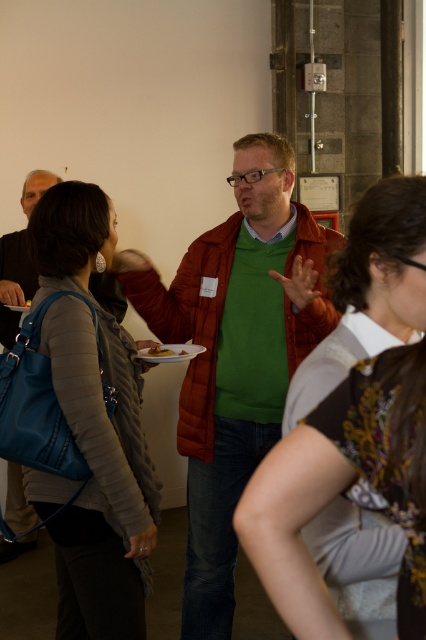
Question: Is matte blue leather handbag at left thinner than floral-patterned blouse at center?

Choices:
 (A) yes
 (B) no

Answer: (B)

Question: Based on their relative distances, which object is nearer to the matte blue leather handbag at left?

Choices:
 (A) matte green sweater at center
 (B) floral-patterned blouse at center

Answer: (A)

Question: Does matte green sweater at center have a lesser width compared to floral-patterned blouse at center?

Choices:
 (A) no
 (B) yes

Answer: (A)

Question: Which object is farther from the camera taking this photo?

Choices:
 (A) matte green sweater at center
 (B) floral-patterned blouse at center

Answer: (A)

Question: Can you confirm if matte green sweater at center is positioned to the left of matte blue leather handbag at left?

Choices:
 (A) yes
 (B) no

Answer: (B)

Question: Which object is positioned farthest from the matte blue leather handbag at left?

Choices:
 (A) floral-patterned blouse at center
 (B) matte green sweater at center

Answer: (A)